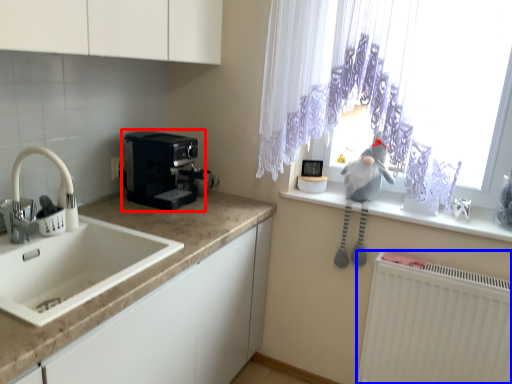
Question: Which of the following is the farthest to the observer, coffee maker (highlighted by a red box) or radiator (highlighted by a blue box)?

Choices:
 (A) coffee maker
 (B) radiator

Answer: (A)